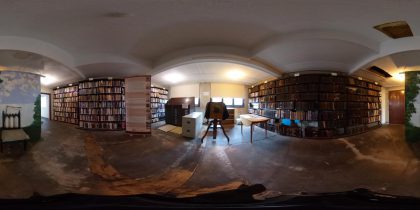
The width and height of the screenshot is (420, 210). Find the location of `filing cabinet`. filing cabinet is located at coordinates (192, 127).